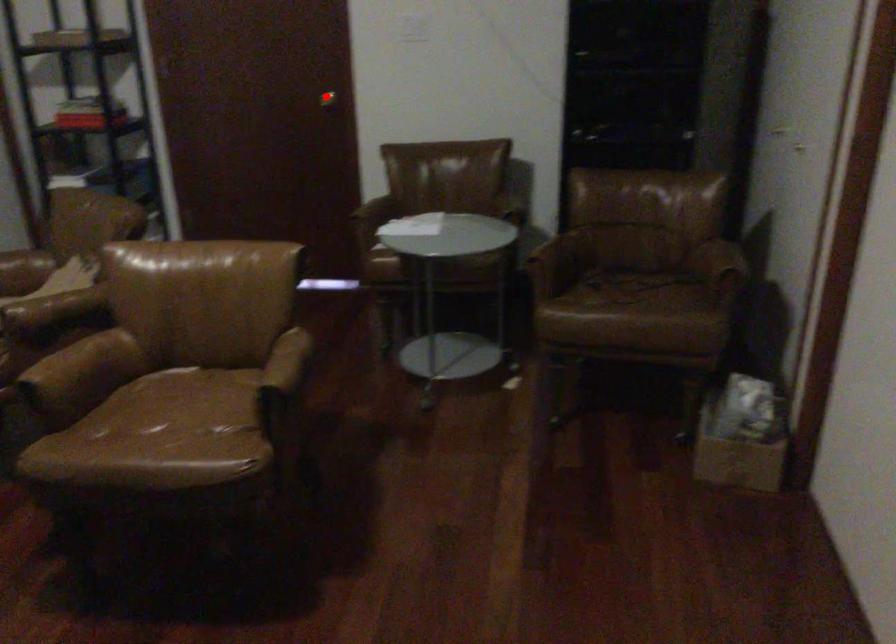
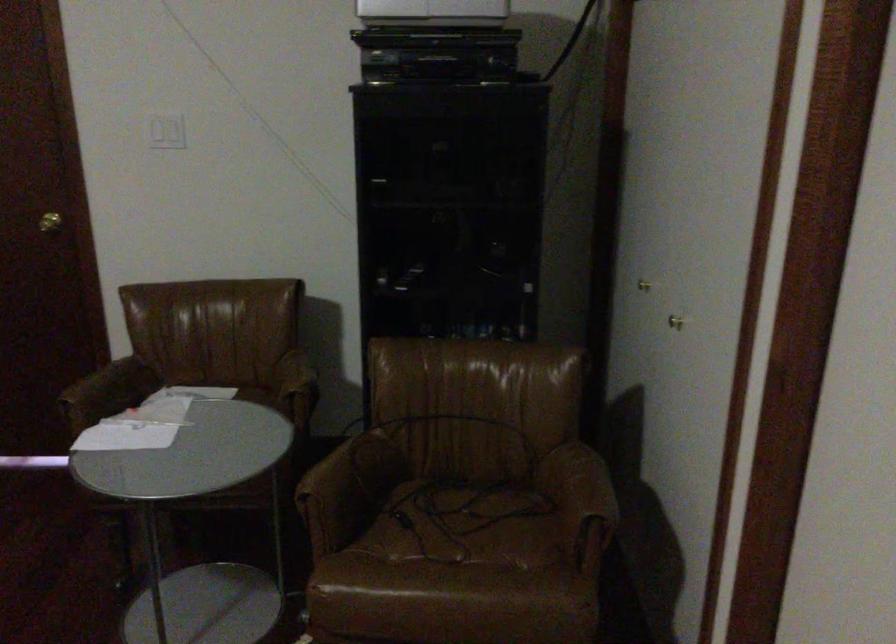
Find the pixel in the second image that matches the highlighted location in the first image.

(49, 222)